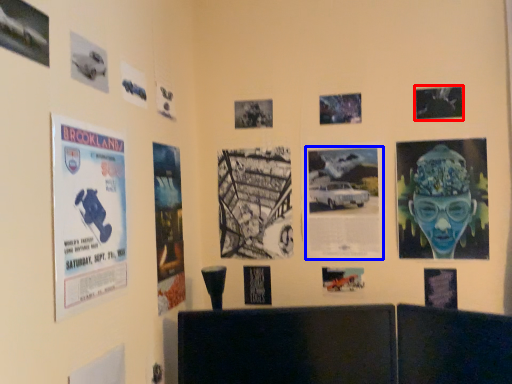
Question: Which object appears farthest to the camera in this image, poster (highlighted by a red box) or poster (highlighted by a blue box)?

Choices:
 (A) poster
 (B) poster

Answer: (B)